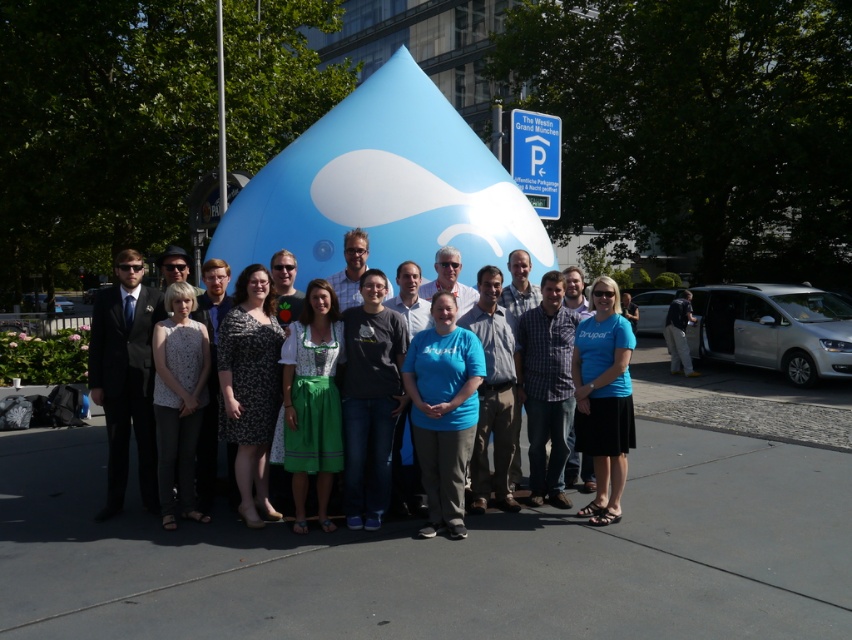
Can you confirm if matte black suit at left is positioned to the right of blue fabric dress at center?

Incorrect, matte black suit at left is not on the right side of blue fabric dress at center.

Can you confirm if matte black suit at left is thinner than blue fabric dress at center?

Indeed, matte black suit at left has a lesser width compared to blue fabric dress at center.

Does point (137, 340) come behind point (281, 387)?

Yes, it is behind point (281, 387).

You are a GUI agent. You are given a task and a screenshot of the screen. Output one action in this format:
    pyautogui.click(x=<x>, y=<y>)
    Task: Click on the matte black suit at left
    Image resolution: width=852 pixels, height=640 pixels.
    Given the screenshot: What is the action you would take?
    pyautogui.click(x=125, y=378)